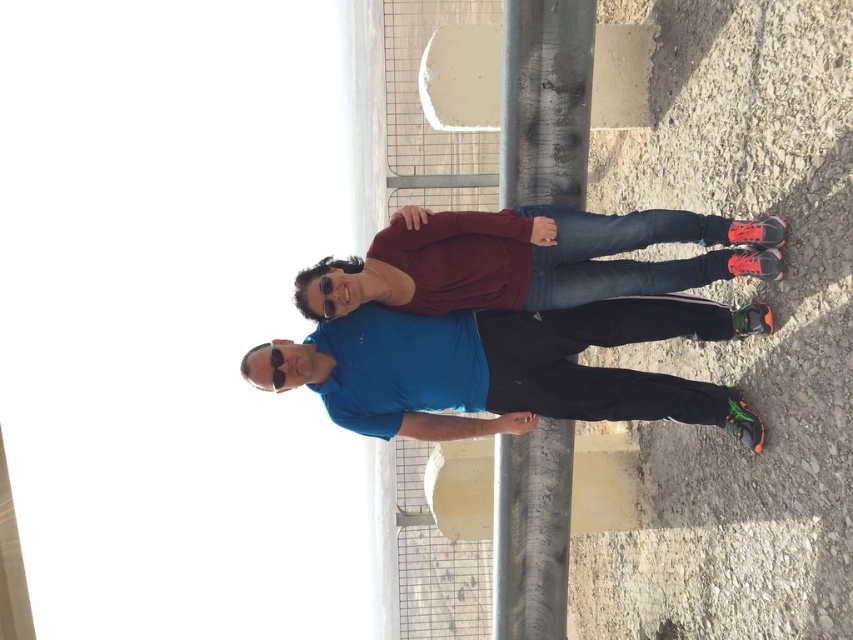
Between point (337, 385) and point (529, 125), which one is positioned in front?

Point (337, 385)

You are a GUI agent. You are given a task and a screenshot of the screen. Output one action in this format:
    pyautogui.click(x=<x>, y=<y>)
    Task: Click on the blue matte shirt at center
    The width and height of the screenshot is (853, 640).
    Given the screenshot: What is the action you would take?
    pyautogui.click(x=508, y=369)

This screenshot has height=640, width=853. What do you see at coordinates (508, 369) in the screenshot? I see `blue matte shirt at center` at bounding box center [508, 369].

You are a GUI agent. You are given a task and a screenshot of the screen. Output one action in this format:
    pyautogui.click(x=<x>, y=<y>)
    Task: Click on the blue matte shirt at center
    
    Given the screenshot: What is the action you would take?
    pyautogui.click(x=508, y=369)

In the scene shown: Does blue matte shirt at center have a greater height compared to matte maroon sweater at center?

Yes.

Which of these two, blue matte shirt at center or matte maroon sweater at center, stands taller?

Standing taller between the two is blue matte shirt at center.

Locate an element on the screen. blue matte shirt at center is located at coordinates (508, 369).

Describe the element at coordinates (531, 259) in the screenshot. The width and height of the screenshot is (853, 640). I see `matte maroon sweater at center` at that location.

Find the location of a particular element. Image resolution: width=853 pixels, height=640 pixels. matte maroon sweater at center is located at coordinates (531, 259).

Locate an element on the screen. The width and height of the screenshot is (853, 640). matte maroon sweater at center is located at coordinates (531, 259).